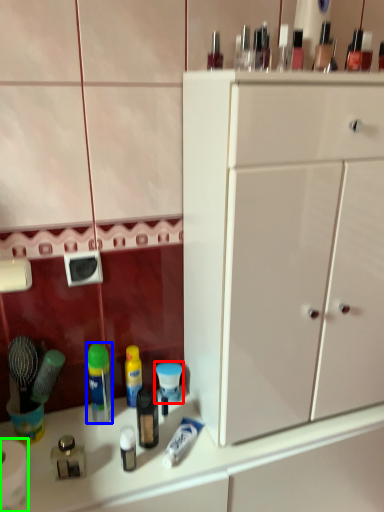
Question: Estimate the real-world distances between objects in this image. Which object is farther from toiletry (highlighted by a red box), mouthwash (highlighted by a blue box) or toilet paper (highlighted by a green box)?

Choices:
 (A) mouthwash
 (B) toilet paper

Answer: (B)